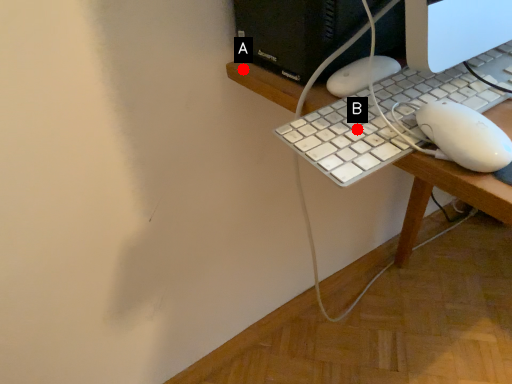
Question: Two points are circled on the image, labeled by A and B beside each circle. Which point is further to the camera?

Choices:
 (A) A is further
 (B) B is further

Answer: (A)